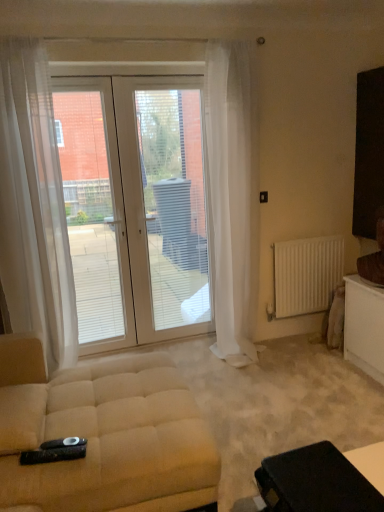
Describe the element at coordinates (168, 213) in the screenshot. Image resolution: width=384 pixels, height=512 pixels. I see `white glass door at center` at that location.

Image resolution: width=384 pixels, height=512 pixels. What are the coordinates of `white sheer curtain at left, positioned as the second curtain in right-to-left order` in the screenshot? It's located at (34, 206).

Based on the photo, from a real-world perspective, is white sheer curtain at center, the second curtain viewed from the left, physically above white glass door at center?

Yes, from a real-world perspective, white sheer curtain at center, the second curtain viewed from the left, is on top of white glass door at center.

From the image's perspective, is white sheer curtain at center, which appears as the 1th curtain when viewed from the right, over white glass door at center?

Yes, from the image's perspective, white sheer curtain at center, which appears as the 1th curtain when viewed from the right, is over white glass door at center.

Which is more to the left, white sheer curtain at center, the second curtain viewed from the left, or white glass door at center?

Positioned to the left is white glass door at center.

Does white sheer curtain at center, the second curtain viewed from the left, have a smaller size compared to white glass door at center?

Actually, white sheer curtain at center, the second curtain viewed from the left, might be larger than white glass door at center.

Is white glass door at center not near white matte radiator at right?

No, there isn't a large distance between white glass door at center and white matte radiator at right.

Locate an element on the screen. radiator on the right of the white glass door at center is located at coordinates (307, 274).

Which object is wider, white glass door at center or white matte radiator at right?

white glass door at center is wider.

Where is `studio couch on the left of the white glass door at center`? This screenshot has height=512, width=384. studio couch on the left of the white glass door at center is located at coordinates (103, 435).

Between point (179, 144) and point (207, 461), which one is positioned behind?

The point (179, 144) is farther.

From the image's perspective, which one is positioned lower, white glass door at center or beige fabric studio couch at lower left?

From the image's view, beige fabric studio couch at lower left is below.

Between white glass door at center and beige fabric studio couch at lower left, which one has less height?

Standing shorter between the two is beige fabric studio couch at lower left.

From the image's perspective, is white matte radiator at right under white glass door at center?

Yes, from the image's perspective, white matte radiator at right is below white glass door at center.

Does white matte radiator at right turn towards white glass door at center?

No, white matte radiator at right is not facing towards white glass door at center.

Is white matte radiator at right far away from white glass door at center?

No, white matte radiator at right is not far from white glass door at center.

Looking at this image, considering the relative positions of white sheer curtain at left, which ranks as the first curtain in left-to-right order, and beige fabric studio couch at lower left in the image provided, is white sheer curtain at left, which ranks as the first curtain in left-to-right order, in front of beige fabric studio couch at lower left?

No, white sheer curtain at left, which ranks as the first curtain in left-to-right order, is further to the viewer.

Considering the relative sizes of white sheer curtain at left, positioned as the second curtain in right-to-left order, and beige fabric studio couch at lower left in the image provided, is white sheer curtain at left, positioned as the second curtain in right-to-left order, thinner than beige fabric studio couch at lower left?

Yes.

I want to click on the 1st curtain located above the beige fabric studio couch at lower left (from a real-world perspective), so click(34, 206).

From the image's perspective, does white sheer curtain at left, positioned as the second curtain in right-to-left order, appear lower than beige fabric studio couch at lower left?

No, from the image's perspective, white sheer curtain at left, positioned as the second curtain in right-to-left order, is not beneath beige fabric studio couch at lower left.

Is black leather table at lower right at the left side of white glass door at center?

Incorrect, black leather table at lower right is not on the left side of white glass door at center.

Between black leather table at lower right and white glass door at center, which one has smaller size?

With smaller size is black leather table at lower right.

How much distance is there between black leather table at lower right and white glass door at center?

black leather table at lower right and white glass door at center are 6.69 feet apart from each other.

Could you tell me if black leather table at lower right is facing white glass door at center?

No, black leather table at lower right is not facing towards white glass door at center.

Is beige fabric studio couch at lower left facing away from black leather table at lower right?

beige fabric studio couch at lower left is not turned away from black leather table at lower right.

Is beige fabric studio couch at lower left thinner than black leather table at lower right?

No.

Between beige fabric studio couch at lower left and black leather table at lower right, which one is positioned behind?

beige fabric studio couch at lower left is behind.

Locate an element on the screen. Image resolution: width=384 pixels, height=512 pixels. screen door that is behind the white sheer curtain at center, which appears as the 1th curtain when viewed from the right is located at coordinates (168, 213).

Where is `screen door on the left of white matte radiator at right`? screen door on the left of white matte radiator at right is located at coordinates (168, 213).

Based on their spatial positions, is black leather table at lower right or white sheer curtain at left, positioned as the second curtain in right-to-left order, closer to white matte radiator at right?

white sheer curtain at left, positioned as the second curtain in right-to-left order, is closer to white matte radiator at right.

Based on their spatial positions, is black leather table at lower right or beige fabric studio couch at lower left closer to white glass door at center?

beige fabric studio couch at lower left.

When comparing their distances from white sheer curtain at center, the second curtain viewed from the left, does white glass door at center or white sheer curtain at left, which ranks as the first curtain in left-to-right order, seem further?

Based on the image, white sheer curtain at left, which ranks as the first curtain in left-to-right order, appears to be further to white sheer curtain at center, the second curtain viewed from the left.

Based on their spatial positions, is beige fabric studio couch at lower left or white glass door at center closer to white glass door at center?

white glass door at center.

From the image, which object appears to be farther from white glass door at center, white sheer curtain at left, which ranks as the first curtain in left-to-right order, or white glass door at center?

white sheer curtain at left, which ranks as the first curtain in left-to-right order.

Considering their positions, is white sheer curtain at left, positioned as the second curtain in right-to-left order, positioned further to beige fabric studio couch at lower left than black leather table at lower right?

white sheer curtain at left, positioned as the second curtain in right-to-left order, lies further to beige fabric studio couch at lower left than the other object.

When comparing their distances from white sheer curtain at left, which ranks as the first curtain in left-to-right order, does black leather table at lower right or white matte radiator at right seem further?

Based on the image, black leather table at lower right appears to be further to white sheer curtain at left, which ranks as the first curtain in left-to-right order.

From the image, which object appears to be nearer to white glass door at center, black leather table at lower right or white sheer curtain at left, which ranks as the first curtain in left-to-right order?

The object closer to white glass door at center is white sheer curtain at left, which ranks as the first curtain in left-to-right order.

This screenshot has height=512, width=384. Find the location of `screen door between black leather table at lower right and white matte radiator at right in the front-back direction`. screen door between black leather table at lower right and white matte radiator at right in the front-back direction is located at coordinates (168, 213).

Where is `screen door between beige fabric studio couch at lower left and white matte radiator at right in the front-back direction`? Image resolution: width=384 pixels, height=512 pixels. screen door between beige fabric studio couch at lower left and white matte radiator at right in the front-back direction is located at coordinates (168, 213).

Locate an element on the screen. The width and height of the screenshot is (384, 512). screen door between white sheer curtain at left, positioned as the second curtain in right-to-left order, and white sheer curtain at center, the second curtain viewed from the left, from left to right is located at coordinates (168, 213).

You are a GUI agent. You are given a task and a screenshot of the screen. Output one action in this format:
    pyautogui.click(x=<x>, y=<y>)
    Task: Click on the studio couch between white sheer curtain at left, which ranks as the first curtain in left-to-right order, and white matte radiator at right
    The image size is (384, 512).
    Given the screenshot: What is the action you would take?
    pyautogui.click(x=103, y=435)